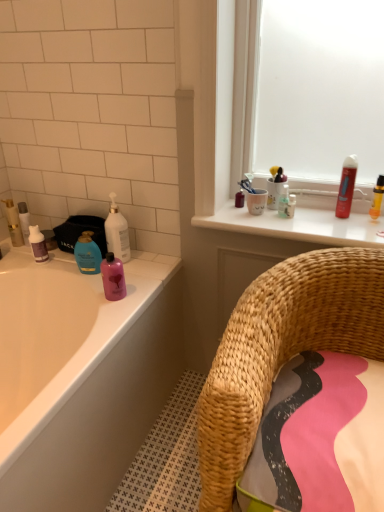
Measure the distance between translucent plastic toothbrush at upper center, the third toiletry from the right, and camera.

The distance of translucent plastic toothbrush at upper center, the third toiletry from the right, from camera is 1.52 meters.

This screenshot has width=384, height=512. What do you see at coordinates (24, 221) in the screenshot? I see `matte white tube at left, which is the 2th toiletry from left to right` at bounding box center [24, 221].

Image resolution: width=384 pixels, height=512 pixels. Describe the element at coordinates (377, 198) in the screenshot. I see `translucent yellow bottle at upper right, positioned as the first toiletry in right-to-left order` at that location.

Image resolution: width=384 pixels, height=512 pixels. I want to click on matte gold lotion at left, the 1th toiletry in the left-to-right sequence, so click(13, 222).

What do you see at coordinates (87, 254) in the screenshot? I see `blue glossy lotion at left, which is counted as the 4th toiletry, starting from the right` at bounding box center [87, 254].

What do you see at coordinates (297, 225) in the screenshot? This screenshot has height=512, width=384. I see `white glossy counter top at upper center` at bounding box center [297, 225].

The height and width of the screenshot is (512, 384). Find the location of `translucent plastic toothbrush at upper center, which appears as the 4th toiletry when viewed from the left`. translucent plastic toothbrush at upper center, which appears as the 4th toiletry when viewed from the left is located at coordinates 283,202.

Is white glossy counter top at upper center at the back of woven straw chair at lower right?

Yes, white glossy counter top at upper center is at the back of woven straw chair at lower right.

Does point (247, 351) appear closer or farther from the camera than point (261, 216)?

Point (247, 351) appears to be closer to the viewer than point (261, 216).

Which is nearer, (38, 255) or (104, 265)?

Point (104, 265)

Where is `the 2nd mouthwash behind the pink glossy bottle at upper left, which appears as the second mouthwash when viewed from the right, counting from the anchor's position`? This screenshot has height=512, width=384. the 2nd mouthwash behind the pink glossy bottle at upper left, which appears as the second mouthwash when viewed from the right, counting from the anchor's position is located at coordinates (38, 244).

From a real-world perspective, between purple matte bottle at left, arranged as the second mouthwash when ordered from the bottom, and pink glossy bottle at upper left, which appears as the second mouthwash when viewed from the left, who is vertically lower?

pink glossy bottle at upper left, which appears as the second mouthwash when viewed from the left, is physically lower.

Is purple matte bottle at left, the second mouthwash in the top-to-bottom sequence, not close to pink glossy bottle at upper left, the 3th mouthwash in the top-to-bottom sequence?

No.

What's the angular difference between translucent yellow bottle at upper right, positioned as the first toiletry in right-to-left order, and pink glossy bottle at upper left, the first mouthwash from the bottom,'s facing directions?

They differ by 0.578 degrees in their facing directions.

From the image's perspective, is translucent yellow bottle at upper right, positioned as the first toiletry in right-to-left order, over pink glossy bottle at upper left, the 3th mouthwash in the top-to-bottom sequence?

Yes, from the image's perspective, translucent yellow bottle at upper right, positioned as the first toiletry in right-to-left order, is above pink glossy bottle at upper left, the 3th mouthwash in the top-to-bottom sequence.

Starting from the translucent yellow bottle at upper right, the 6th toiletry viewed from the left, which mouthwash is the 2nd one to the left? Please provide its 2D coordinates.

[(113, 277)]

Can you confirm if pink fabric bath towel at lower right is taller than matte white tube at left, which is the 2th toiletry from left to right?

Indeed, pink fabric bath towel at lower right has a greater height compared to matte white tube at left, which is the 2th toiletry from left to right.

Can you confirm if pink fabric bath towel at lower right is wider than matte white tube at left, which is the 2th toiletry from left to right?

Yes.

Who is bigger, pink fabric bath towel at lower right or matte white tube at left, which is the 2th toiletry from left to right?

With larger size is pink fabric bath towel at lower right.

Considering the positions of point (307, 381) and point (28, 213), is point (307, 381) closer or farther from the camera than point (28, 213)?

Point (307, 381) appears to be closer to the viewer than point (28, 213).

How many degrees apart are the facing directions of white glossy counter top at upper center and matte white bathtub at left?

They differ by 89.4 degrees in their facing directions.

Is white glossy counter top at upper center aimed at matte white bathtub at left?

No.

Based on the photo, does white glossy counter top at upper center have a greater height compared to matte white bathtub at left?

Incorrect, the height of white glossy counter top at upper center is not larger of that of matte white bathtub at left.

Is matte gold lotion at left, the 6th toiletry from the right, not close to translucent plastic toothbrush holder at upper center, the 2th toiletry in the right-to-left sequence?

matte gold lotion at left, the 6th toiletry from the right, is positioned a significant distance from translucent plastic toothbrush holder at upper center, the 2th toiletry in the right-to-left sequence.

From the picture: From the image's perspective, is matte gold lotion at left, the 6th toiletry from the right, positioned above or below translucent plastic toothbrush holder at upper center, the 2th toiletry in the right-to-left sequence?

Clearly, from the image's perspective, matte gold lotion at left, the 6th toiletry from the right, is below translucent plastic toothbrush holder at upper center, the 2th toiletry in the right-to-left sequence.

Would you say matte gold lotion at left, the 1th toiletry in the left-to-right sequence, is inside or outside translucent plastic toothbrush holder at upper center, the 5th toiletry when ordered from left to right?

matte gold lotion at left, the 1th toiletry in the left-to-right sequence, exists outside the volume of translucent plastic toothbrush holder at upper center, the 5th toiletry when ordered from left to right.

Considering the sizes of objects matte gold lotion at left, the 1th toiletry in the left-to-right sequence, and translucent plastic toothbrush holder at upper center, the 5th toiletry when ordered from left to right, in the image provided, who is thinner, matte gold lotion at left, the 1th toiletry in the left-to-right sequence, or translucent plastic toothbrush holder at upper center, the 5th toiletry when ordered from left to right,?

translucent plastic toothbrush holder at upper center, the 5th toiletry when ordered from left to right.

Which of these two, matte white bathtub at left or white glossy bottle at upper left, is bigger?

With larger size is matte white bathtub at left.

Between matte white bathtub at left and white glossy bottle at upper left, which one appears on the right side from the viewer's perspective?

From the viewer's perspective, white glossy bottle at upper left appears more on the right side.

Does matte white bathtub at left lie in front of white glossy bottle at upper left?

Yes, matte white bathtub at left is closer to the camera.

Does matte white bathtub at left have a lesser height compared to white glossy bottle at upper left?

Incorrect, the height of matte white bathtub at left does not fall short of that of white glossy bottle at upper left.

This screenshot has height=512, width=384. What are the coordinates of `counter top that appears above the woven straw chair at lower right (from a real-world perspective)` in the screenshot? It's located at (297, 225).

Starting from the pink glossy bottle at upper left, which appears as the second mouthwash when viewed from the left, which mouthwash is the 2nd one behind? Please provide its 2D coordinates.

[(38, 244)]

Which object lies further to the anchor point matte gold lotion at left, the 1th toiletry in the left-to-right sequence, pink fabric bath towel at lower right or purple matte bottle at left, arranged as the second mouthwash when ordered from the bottom?

Based on the image, pink fabric bath towel at lower right appears to be further to matte gold lotion at left, the 1th toiletry in the left-to-right sequence.

Which object lies nearer to the anchor point purple matte bottle at left, the third mouthwash viewed from the right, blue glossy lotion at left, which is counted as the 4th toiletry, starting from the right, or pink fabric bath towel at lower right?

Among the two, blue glossy lotion at left, which is counted as the 4th toiletry, starting from the right, is located nearer to purple matte bottle at left, the third mouthwash viewed from the right.

Estimate the real-world distances between objects in this image. Which object is closer to woven straw chair at lower right, blue glossy lotion at left, which is counted as the 4th toiletry, starting from the right, or matte white tube at left, marked as the 5th toiletry in a right-to-left arrangement?

blue glossy lotion at left, which is counted as the 4th toiletry, starting from the right.

Based on their spatial positions, is pink fabric bath towel at lower right or white glossy bottle at upper left further from translucent plastic toothbrush holder at upper center, the 2th toiletry in the right-to-left sequence?

Based on the image, pink fabric bath towel at lower right appears to be further to translucent plastic toothbrush holder at upper center, the 2th toiletry in the right-to-left sequence.

When comparing their distances from translucent plastic toothbrush at upper center, which appears as the 4th toiletry when viewed from the left, does pink glossy bottle at upper left, which appears as the second mouthwash when viewed from the left, or pink fabric bath towel at lower right seem closer?

The object closer to translucent plastic toothbrush at upper center, which appears as the 4th toiletry when viewed from the left, is pink glossy bottle at upper left, which appears as the second mouthwash when viewed from the left.

From the image, which object appears to be nearer to matte white bathtub at left, translucent plastic toothbrush at upper center, which appears as the 4th toiletry when viewed from the left, or white glossy bottle at upper left?

white glossy bottle at upper left.

Estimate the real-world distances between objects in this image. Which object is further from blue glossy lotion at left, which is counted as the 4th toiletry, starting from the right, purple matte bottle at left, the third mouthwash viewed from the right, or pink glossy bottle at upper left, which appears as the second mouthwash when viewed from the right?

purple matte bottle at left, the third mouthwash viewed from the right, is further to blue glossy lotion at left, which is counted as the 4th toiletry, starting from the right.

Based on their spatial positions, is translucent plastic toothbrush holder at upper center, the 5th toiletry when ordered from left to right, or pink fabric bath towel at lower right further from translucent plastic toothbrush at upper center, the third toiletry from the right?

Based on the image, pink fabric bath towel at lower right appears to be further to translucent plastic toothbrush at upper center, the third toiletry from the right.

This screenshot has width=384, height=512. I want to click on cleaning product between woven straw chair at lower right and matte white tube at left, which is the 2th toiletry from left to right, along the z-axis, so click(117, 232).

I want to click on cleaning product between matte white tube at left, which is the 2th toiletry from left to right, and pink glossy bottle at upper left, the first mouthwash from the bottom, from left to right, so click(x=117, y=232).

What are the coordinates of `bath towel located between woven straw chair at lower right and blue glossy lotion at left, placed as the 3th toiletry when sorted from left to right, in the depth direction` in the screenshot? It's located at (321, 437).

This screenshot has width=384, height=512. I want to click on counter top between pink fabric bath towel at lower right and translucent plastic toothbrush holder at upper center, the 2th toiletry in the right-to-left sequence, in the front-back direction, so click(x=297, y=225).